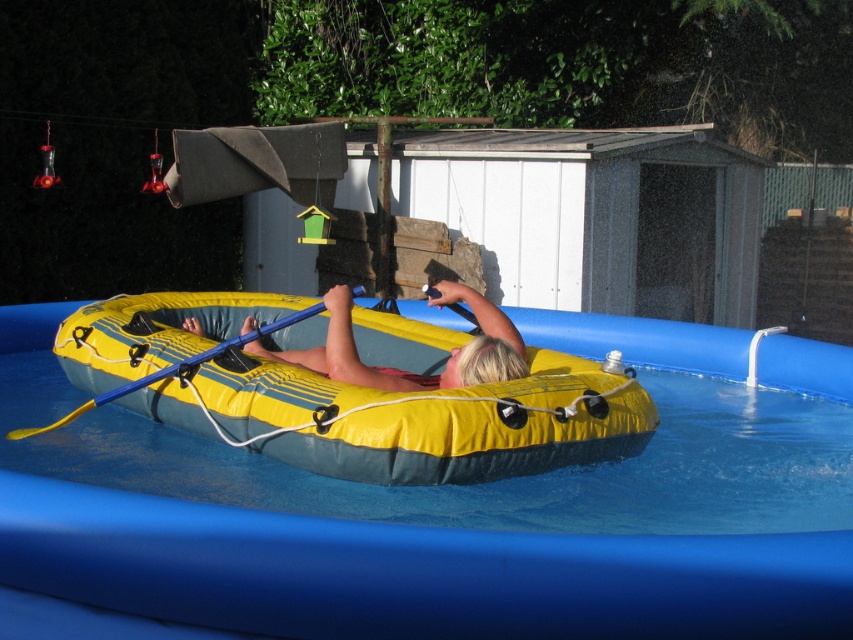
Question: Is blue rubber pool at center above blue plastic paddle at center?

Choices:
 (A) no
 (B) yes

Answer: (B)

Question: Is the position of blonde hair at upper center more distant than that of blue plastic paddle at center?

Choices:
 (A) yes
 (B) no

Answer: (B)

Question: Which object is the farthest from the blue plastic paddle at center?

Choices:
 (A) yellow rubber kayak at center
 (B) blonde hair at upper center
 (C) blue rubber pool at center

Answer: (C)

Question: Considering the real-world distances, which object is farthest from the blue plastic paddle at center?

Choices:
 (A) yellow rubber kayak at center
 (B) blue rubber pool at center
 (C) blonde hair at upper center

Answer: (B)

Question: Estimate the real-world distances between objects in this image. Which object is closer to the blue plastic paddle at center?

Choices:
 (A) blue rubber pool at center
 (B) blonde hair at upper center
 (C) yellow rubber kayak at center

Answer: (C)

Question: Can you confirm if blue rubber pool at center is positioned to the left of blonde hair at upper center?

Choices:
 (A) no
 (B) yes

Answer: (A)